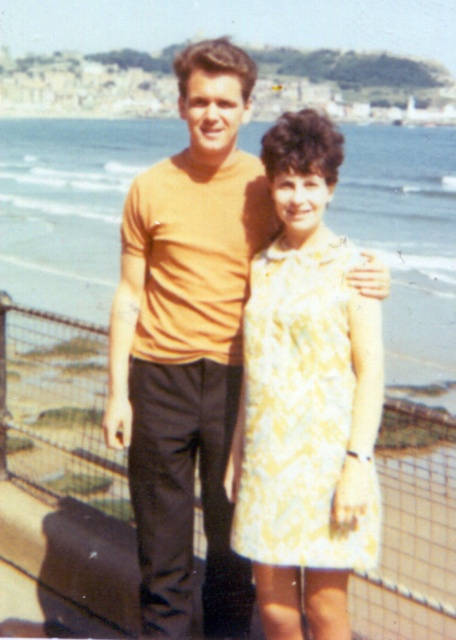
Does point (222, 122) come closer to viewer compared to point (413, 628)?

Yes.

Does matte orange t-shirt at center have a lesser width compared to metal wire fence at center?

Indeed, matte orange t-shirt at center has a lesser width compared to metal wire fence at center.

Who is more distant from viewer, [229,429] or [43,316]?

The point [43,316] is more distant.

Find the location of a particular element. Image resolution: width=456 pixels, height=640 pixels. matte orange t-shirt at center is located at coordinates (187, 342).

Is point (404, 435) positioned after point (328, 296)?

That is True.

Does point (415, 554) lie behind point (364, 566)?

Yes.

Locate an element on the screen. metal wire fence at center is located at coordinates (66, 438).

Is matte orange t-shirt at center in front of yellow floral dress at center?

No, it is behind yellow floral dress at center.

Is matte orange t-shirt at center wider than yellow floral dress at center?

Indeed, matte orange t-shirt at center has a greater width compared to yellow floral dress at center.

Does point (154, 577) come closer to viewer compared to point (290, 500)?

No, it is behind (290, 500).

Image resolution: width=456 pixels, height=640 pixels. I want to click on matte orange t-shirt at center, so click(x=187, y=342).